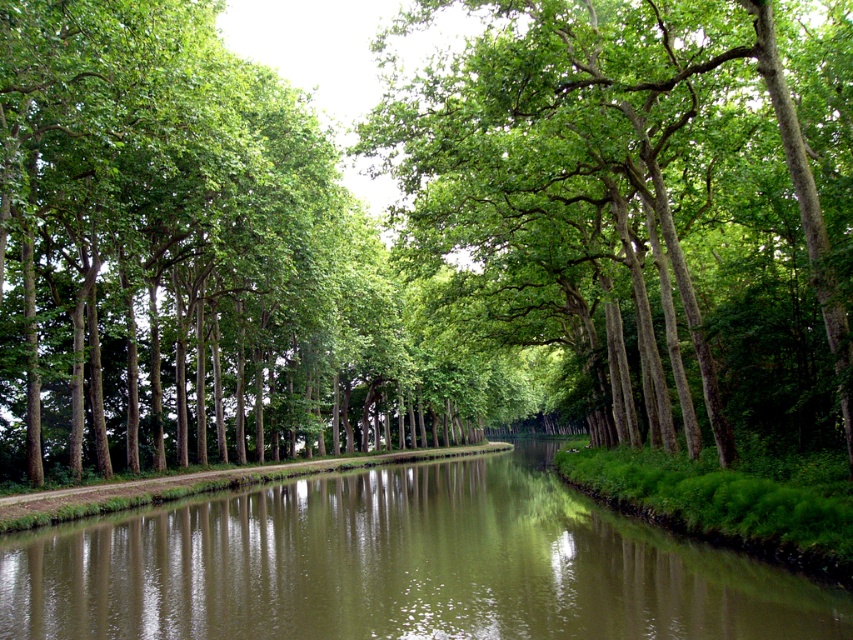
Question: Among these points, which one is farthest from the camera?

Choices:
 (A) (181, 528)
 (B) (485, 262)

Answer: (B)

Question: Which object appears farthest from the camera in this image?

Choices:
 (A) green leafy trees at center
 (B) green reflective water at center

Answer: (A)

Question: Does green leafy trees at center appear on the right side of green reflective water at center?

Choices:
 (A) no
 (B) yes

Answer: (B)

Question: Does green leafy trees at center have a greater width compared to green reflective water at center?

Choices:
 (A) no
 (B) yes

Answer: (B)

Question: Considering the relative positions of green leafy trees at center and green reflective water at center in the image provided, where is green leafy trees at center located with respect to green reflective water at center?

Choices:
 (A) above
 (B) below

Answer: (A)